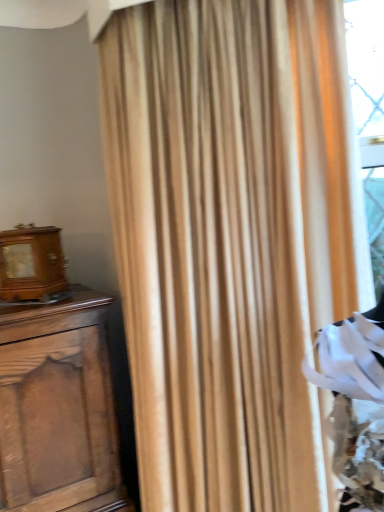
Question: Is matte beige curtain at center wider or thinner than wooden alarm clock at left?

Choices:
 (A) thin
 (B) wide

Answer: (B)

Question: Is point (289, 415) closer or farther from the camera than point (41, 266)?

Choices:
 (A) farther
 (B) closer

Answer: (B)

Question: From a real-world perspective, is matte beige curtain at center above or below wooden alarm clock at left?

Choices:
 (A) above
 (B) below

Answer: (B)

Question: Is point (0, 247) positioned closer to the camera than point (321, 84)?

Choices:
 (A) farther
 (B) closer

Answer: (A)

Question: Is wooden alarm clock at left wider or thinner than matte beige curtain at center?

Choices:
 (A) thin
 (B) wide

Answer: (A)

Question: Relative to matte beige curtain at center, is wooden alarm clock at left in front or behind?

Choices:
 (A) front
 (B) behind

Answer: (B)

Question: Would you say wooden alarm clock at left is to the left or to the right of matte beige curtain at center in the picture?

Choices:
 (A) left
 (B) right

Answer: (A)